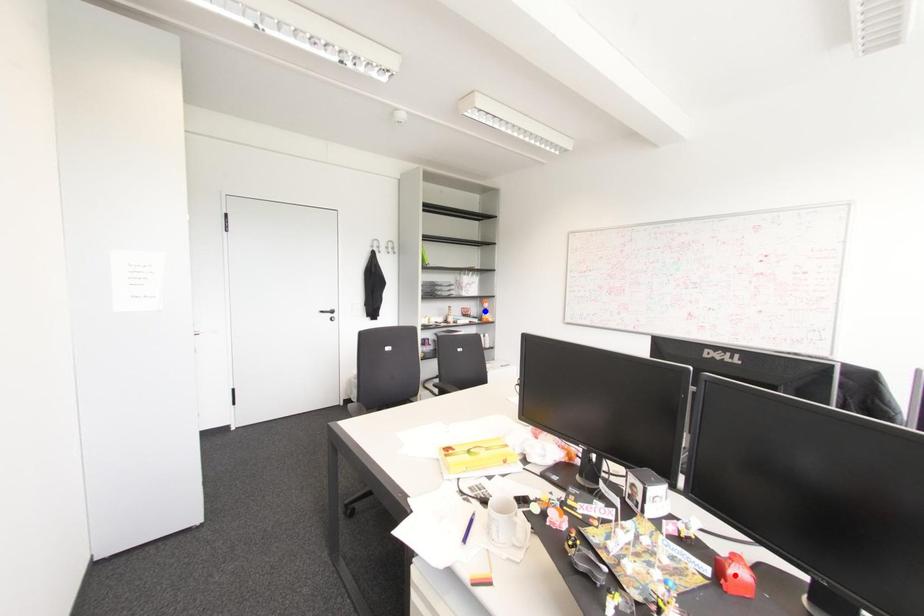
Question: In the image, two points are highlighted. Which point is nearer to the camera? Reply with the corresponding letter.

Choices:
 (A) blue point
 (B) red point

Answer: (B)